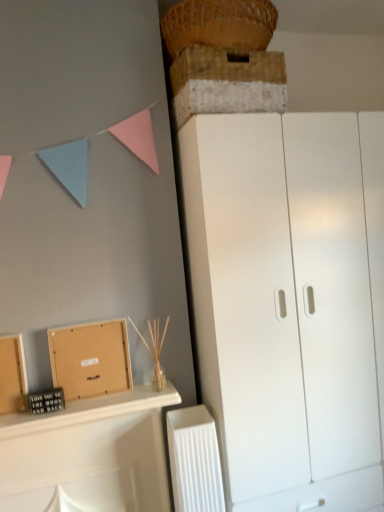
Question: Is rustic wooden crate at upper center to the right of brown cardboard box at lower left from the viewer's perspective?

Choices:
 (A) no
 (B) yes

Answer: (B)

Question: Is rustic wooden crate at upper center to the left of brown cardboard box at lower left from the viewer's perspective?

Choices:
 (A) yes
 (B) no

Answer: (B)

Question: Is rustic wooden crate at upper center next to brown cardboard box at lower left and touching it?

Choices:
 (A) yes
 (B) no

Answer: (B)

Question: Can you confirm if rustic wooden crate at upper center is shorter than brown cardboard box at lower left?

Choices:
 (A) yes
 (B) no

Answer: (A)

Question: From a real-world perspective, is rustic wooden crate at upper center below brown cardboard box at lower left?

Choices:
 (A) yes
 (B) no

Answer: (B)

Question: Is point (77, 354) closer or farther from the camera than point (178, 51)?

Choices:
 (A) farther
 (B) closer

Answer: (B)

Question: Based on their positions, is brown cardboard box at lower left located to the left or right of woven straw basket at upper center?

Choices:
 (A) left
 (B) right

Answer: (A)

Question: From the image's perspective, is brown cardboard box at lower left positioned above or below woven straw basket at upper center?

Choices:
 (A) above
 (B) below

Answer: (B)

Question: In terms of height, does brown cardboard box at lower left look taller or shorter compared to woven straw basket at upper center?

Choices:
 (A) short
 (B) tall

Answer: (B)

Question: Looking at the image, does white plastic radiator at lower center seem bigger or smaller compared to rustic wooden crate at upper center?

Choices:
 (A) small
 (B) big

Answer: (A)

Question: From the image's perspective, is white plastic radiator at lower center above or below rustic wooden crate at upper center?

Choices:
 (A) above
 (B) below

Answer: (B)

Question: From a real-world perspective, is white plastic radiator at lower center above or below rustic wooden crate at upper center?

Choices:
 (A) below
 (B) above

Answer: (A)

Question: Relative to rustic wooden crate at upper center, is white plastic radiator at lower center in front or behind?

Choices:
 (A) behind
 (B) front

Answer: (A)

Question: Considering the positions of white plastic radiator at lower center and woven straw basket at upper center in the image, is white plastic radiator at lower center taller or shorter than woven straw basket at upper center?

Choices:
 (A) short
 (B) tall

Answer: (B)

Question: Is white plastic radiator at lower center inside the boundaries of woven straw basket at upper center, or outside?

Choices:
 (A) inside
 (B) outside

Answer: (B)